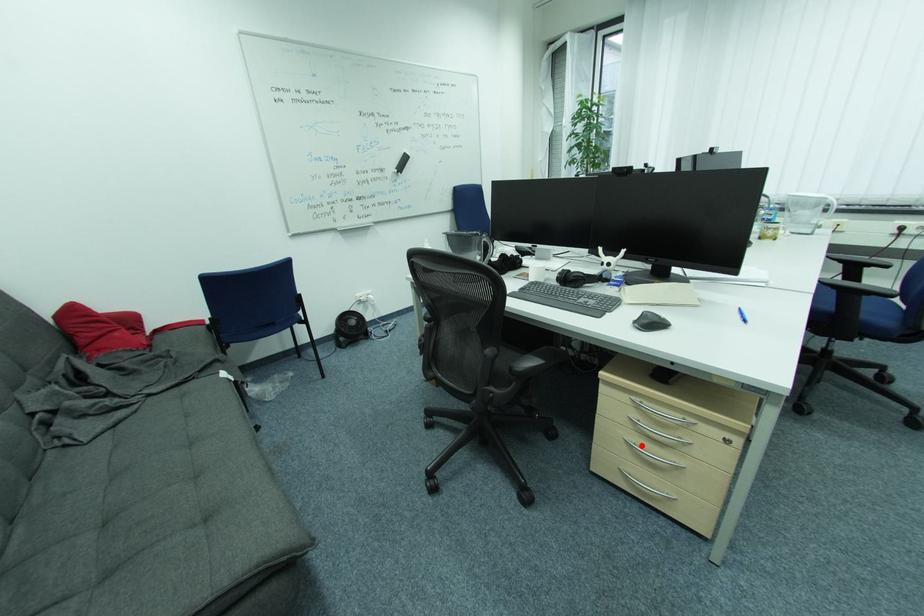
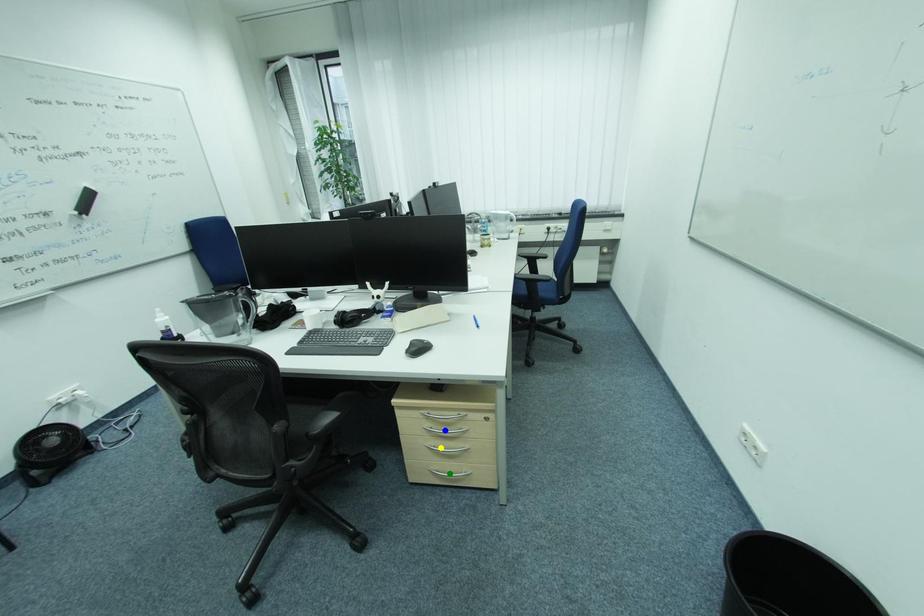
Question: I am providing you with two images of the same scene from different viewpoints. A red point is marked on the first image. You are given multiple points on the second image. Which point in image 2 is actually the same real-world point as the red point in image 1?

Choices:
 (A) blue point
 (B) yellow point
 (C) green point

Answer: (B)